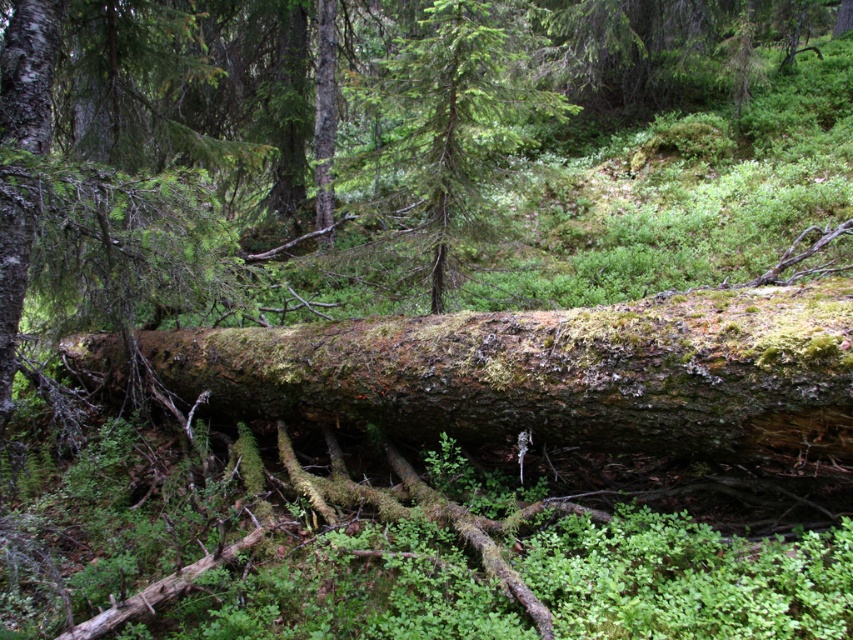
Does mossy bark log at center have a greater height compared to green rough bark tree at center?

Indeed, mossy bark log at center has a greater height compared to green rough bark tree at center.

Is mossy bark log at center below green rough bark tree at center?

Correct, mossy bark log at center is located below green rough bark tree at center.

The width and height of the screenshot is (853, 640). Describe the element at coordinates (554, 372) in the screenshot. I see `mossy bark log at center` at that location.

This screenshot has height=640, width=853. In order to click on mossy bark log at center in this screenshot , I will do `click(554, 372)`.